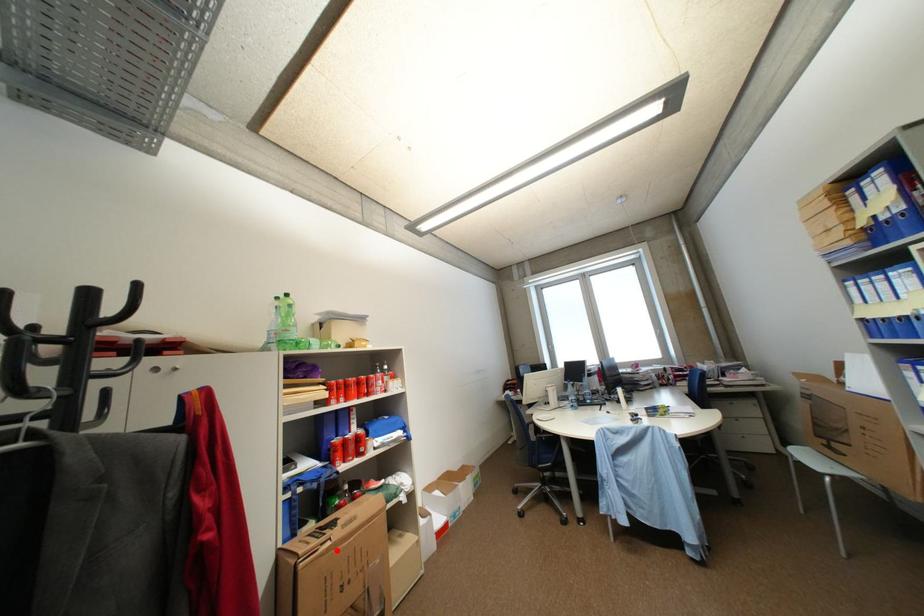
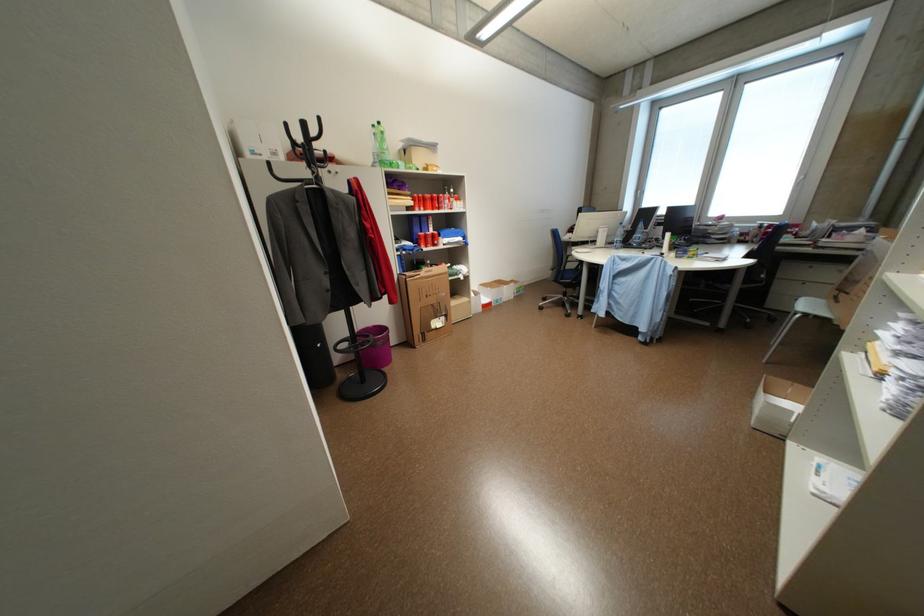
Question: I am providing you with two images of the same scene from different viewpoints. Image1 has a red point marked. In image2, the corresponding 3D location appears at what relative position? Reply with the corresponding letter.

Choices:
 (A) Closer
 (B) Farther

Answer: (A)